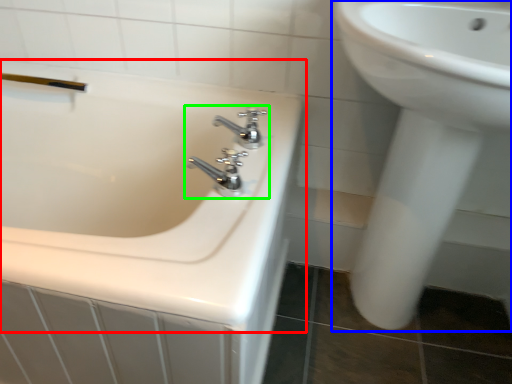
Question: Which object is the closest to the bathtub (highlighted by a red box)? Choose among these: sink (highlighted by a blue box) or tap (highlighted by a green box).

Choices:
 (A) sink
 (B) tap

Answer: (B)